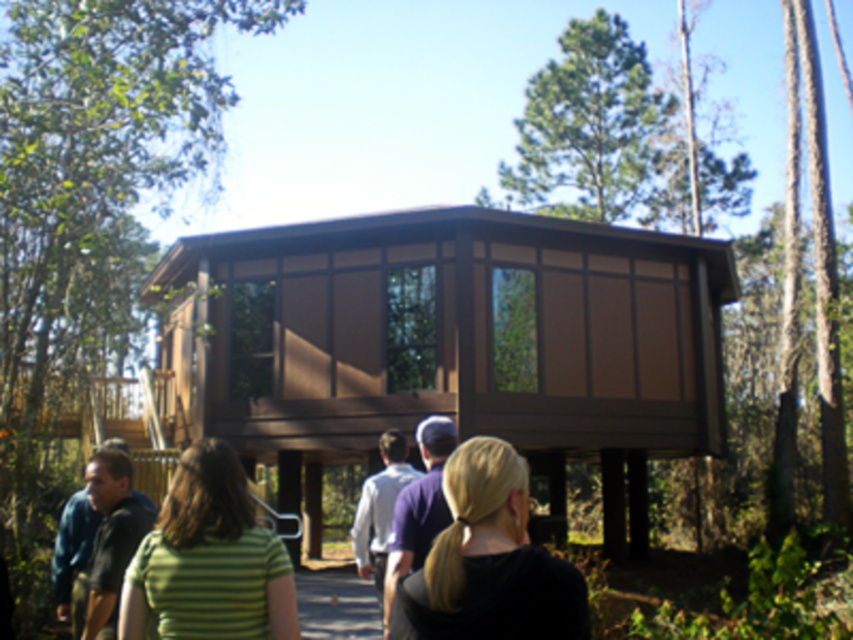
You are a visitor approaching the modern elevated house. You notice a green leafy tree at upper left and a purple cotton shirt at center. Which object is higher in the image?

The green leafy tree at upper left is located above the purple cotton shirt at center, so it is higher in the image.

You are standing in a forest and want to reach the brown wood cabin at center. The path you are on is 12 meters long. Is the path long enough to reach the cabin?

The distance between you and the brown wood cabin at center is 13.60 meters. Since the path is only 12 meters long, it is not long enough to reach the cabin.